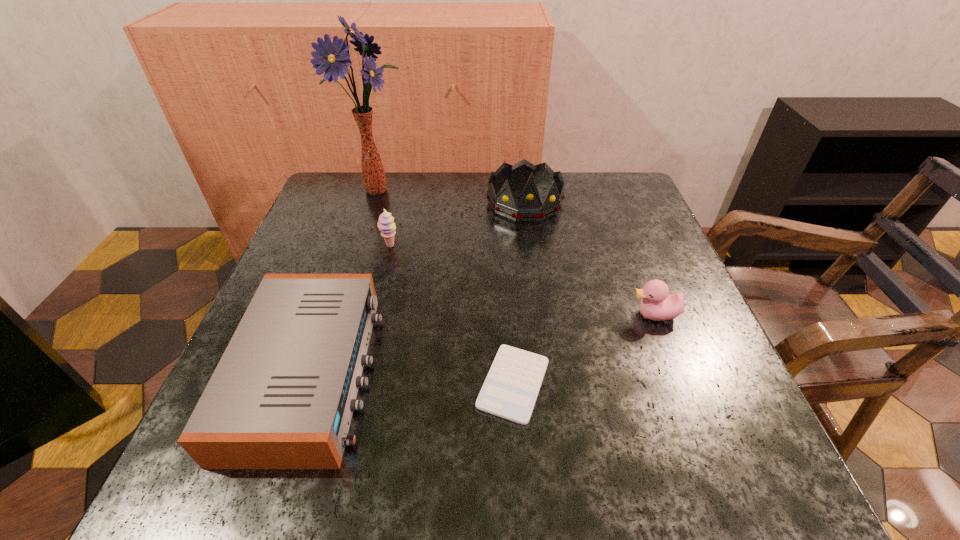
Find the location of `object situated at the right edge`. object situated at the right edge is located at coordinates (657, 304).

Find the location of a particular element. The image size is (960, 540). object located at the far left corner is located at coordinates (332, 58).

This screenshot has width=960, height=540. Find the location of `object located in the near left corner section of the desktop`. object located in the near left corner section of the desktop is located at coordinates (282, 396).

Locate an element on the screen. vacant space at the far edge is located at coordinates (453, 202).

The height and width of the screenshot is (540, 960). What are the coordinates of `vacant space at the near edge` in the screenshot? It's located at 536,446.

In order to click on vacant space at the left edge of the desktop in this screenshot , I will do `click(284, 266)`.

Identify the location of free space at the right edge of the desktop. (644, 267).

In the image, there is a desktop. At what (x,y) coordinates should I click in order to perform the action: click on vacant space at the near left corner. Please return your answer as a coordinate pair (x, y). Looking at the image, I should click on (231, 477).

Where is `vacant space that's between the second tallest object and the third tallest object`? vacant space that's between the second tallest object and the third tallest object is located at coordinates (458, 224).

At what (x,y) coordinates should I click in order to perform the action: click on free space that is in between the calculator and the sherbert. Please return your answer as a coordinate pair (x, y). This screenshot has height=540, width=960. Looking at the image, I should click on (452, 315).